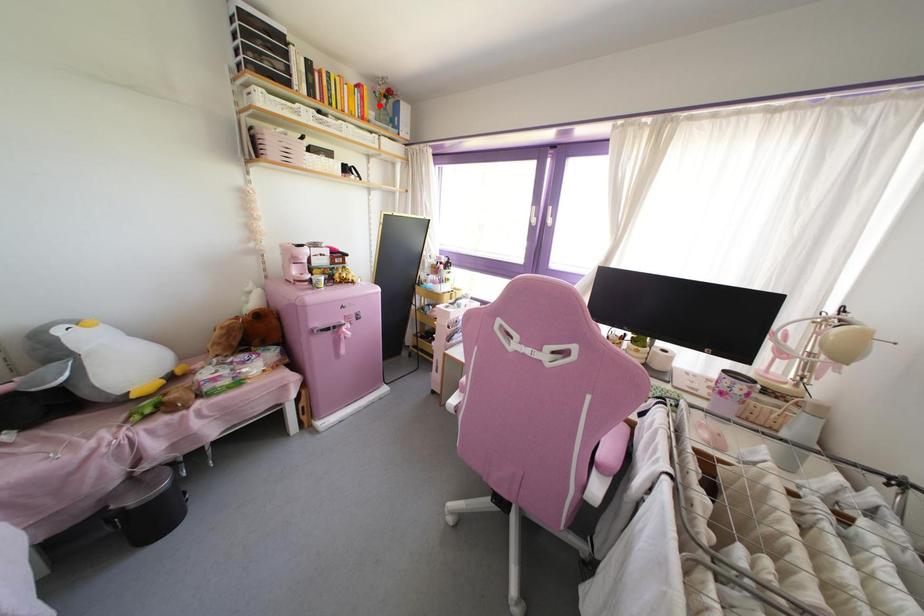
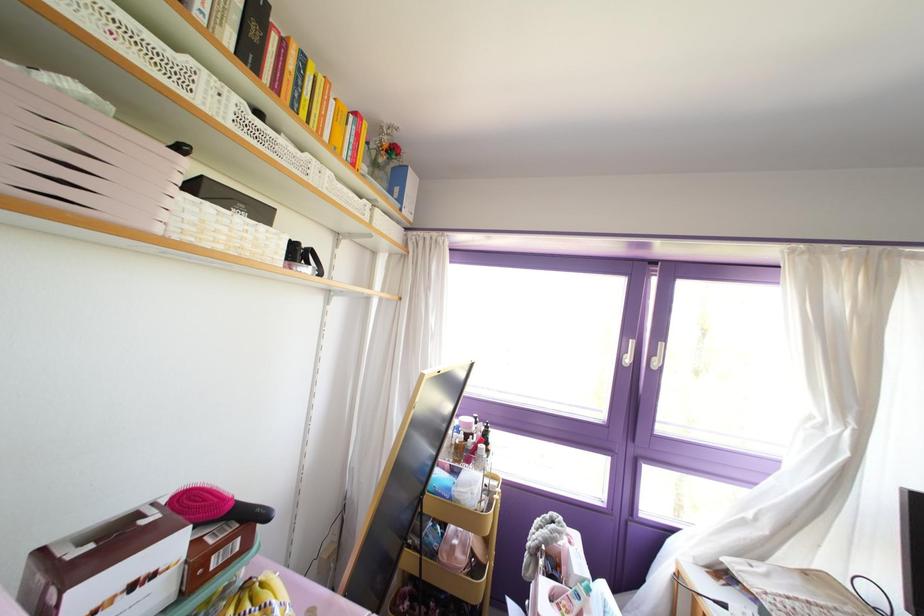
In the second image, find the point that corresponds to the highlighted location in the first image.

(372, 163)